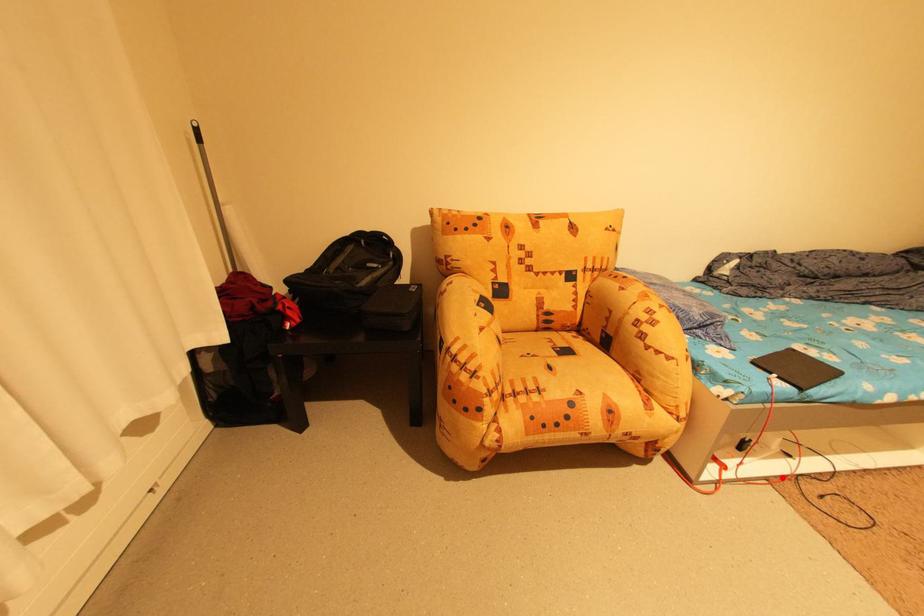
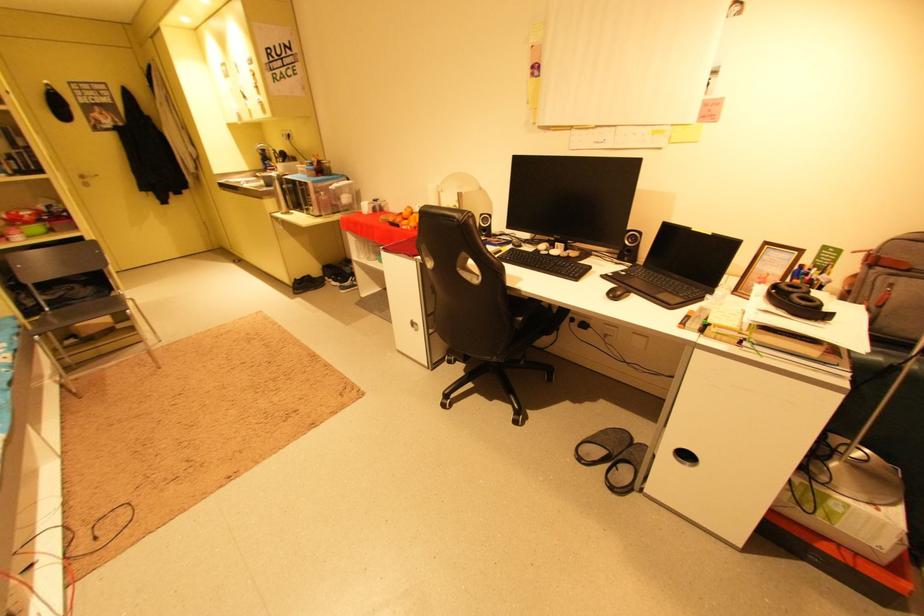
The point at the highlighted location is marked in the first image. Where is the corresponding point in the second image?

(73, 578)